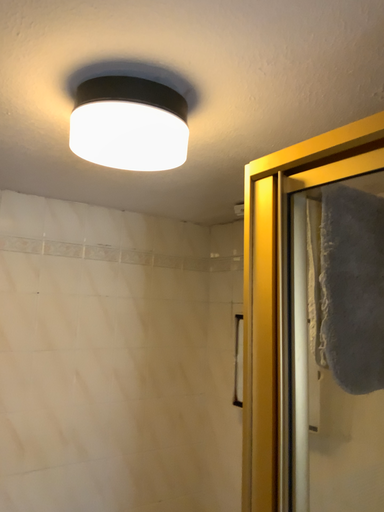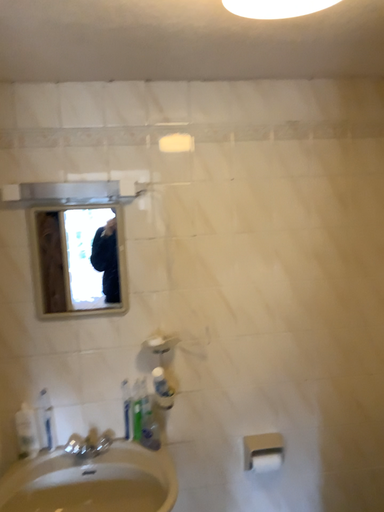
Question: Which way did the camera rotate in the video?

Choices:
 (A) rotated upward
 (B) rotated downward

Answer: (B)